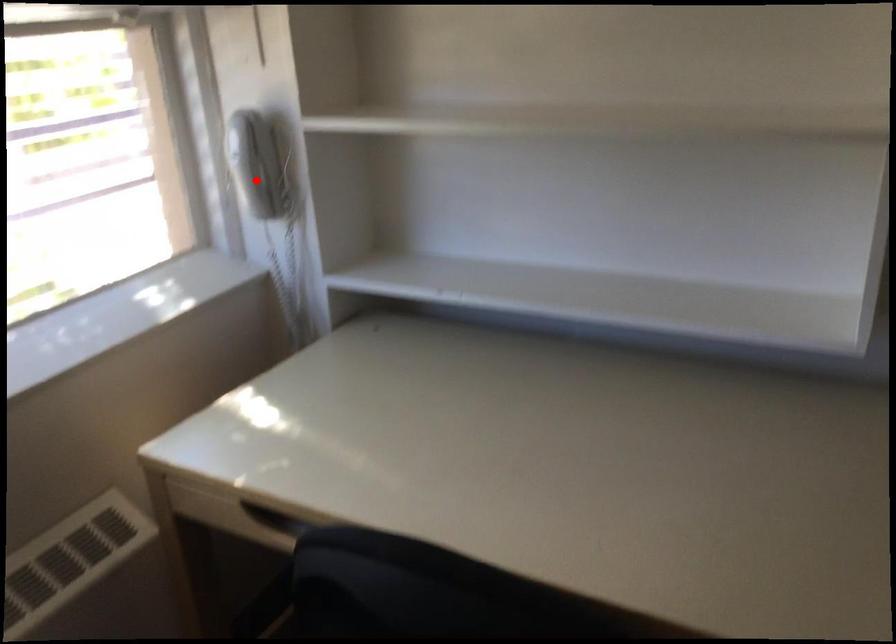
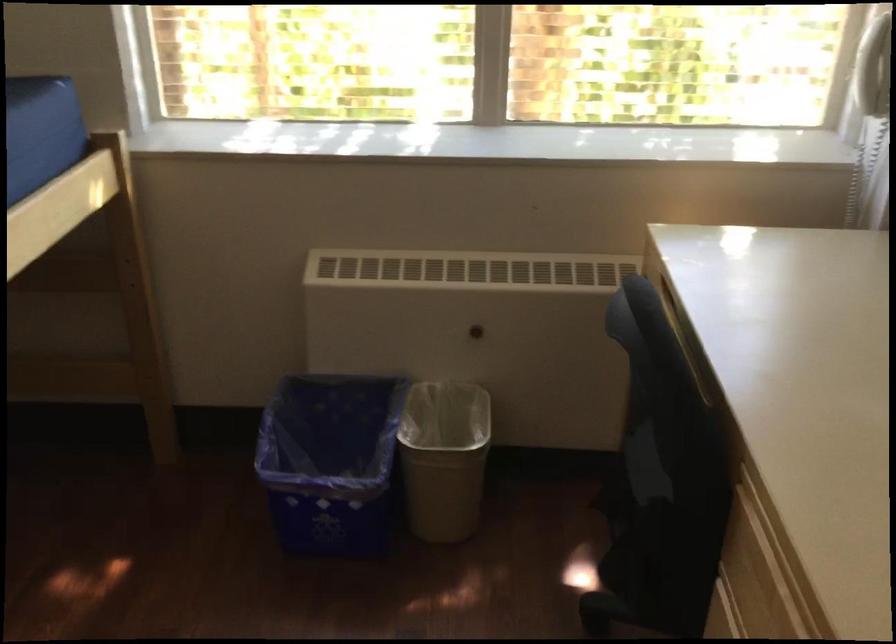
Locate, in the second image, the point that corresponds to the highlighted location in the first image.

(874, 69)